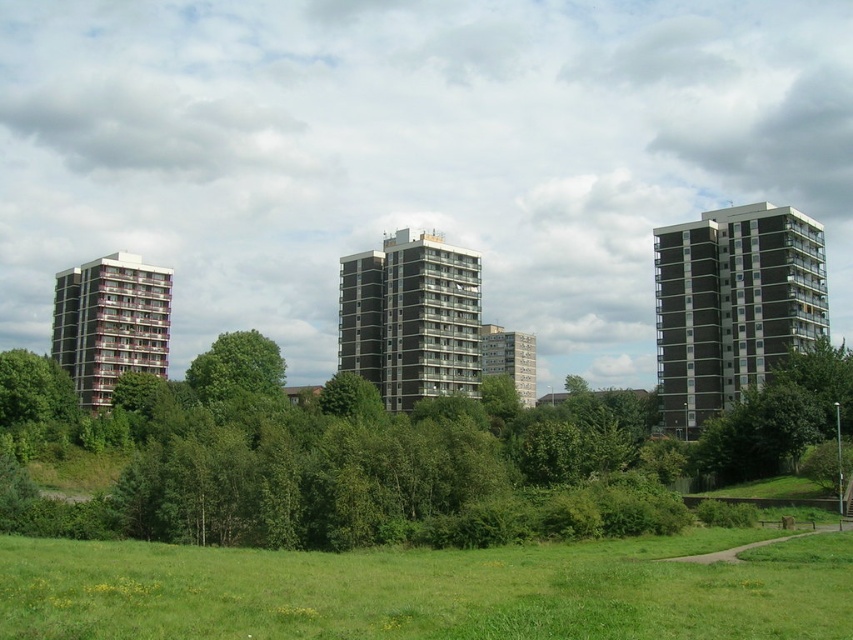
Is green grassy field at lower center smaller than dark gray concrete building at center?

Correct, green grassy field at lower center occupies less space than dark gray concrete building at center.

Between point (592, 634) and point (393, 314), which one is positioned behind?

The point (393, 314) is behind.

Is point (230, 589) in front of point (352, 332)?

Yes, point (230, 589) is in front of point (352, 332).

Locate an element on the screen. green grassy field at lower center is located at coordinates (428, 589).

How far apart are brown brick building at right and dark gray concrete building at center?

brown brick building at right is 147.74 feet away from dark gray concrete building at center.

Is brown brick building at right positioned at the back of dark gray concrete building at center?

No, brown brick building at right is in front of dark gray concrete building at center.

Is point (717, 348) positioned behind point (364, 298)?

No, (717, 348) is closer to viewer.

Where is `brown brick building at right`? The image size is (853, 640). brown brick building at right is located at coordinates (732, 305).

Does dark gray concrete building at center have a lesser height compared to gray concrete building at center?

Incorrect, dark gray concrete building at center's height does not fall short of gray concrete building at center's.

Who is more distant from viewer, (401, 333) or (490, 362)?

The point (490, 362) is more distant.

Identify the location of dark gray concrete building at center. (410, 317).